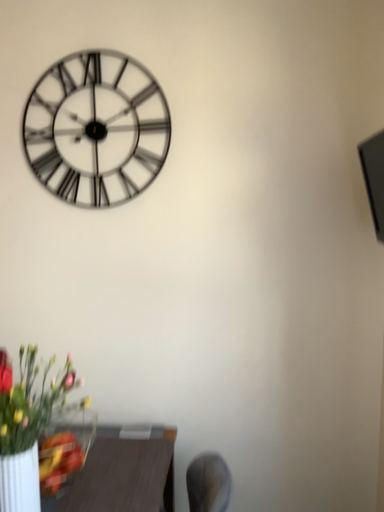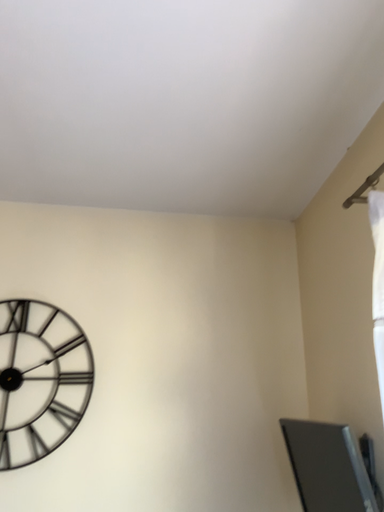
Question: Which way did the camera rotate in the video?

Choices:
 (A) rotated upward
 (B) rotated downward

Answer: (A)